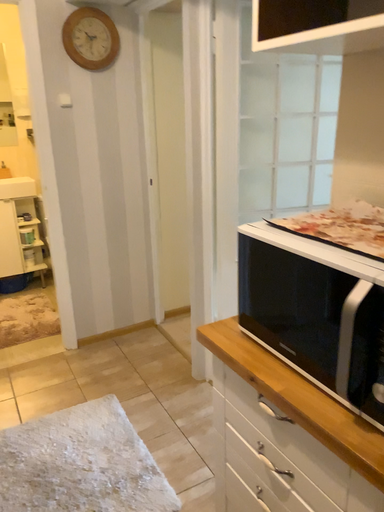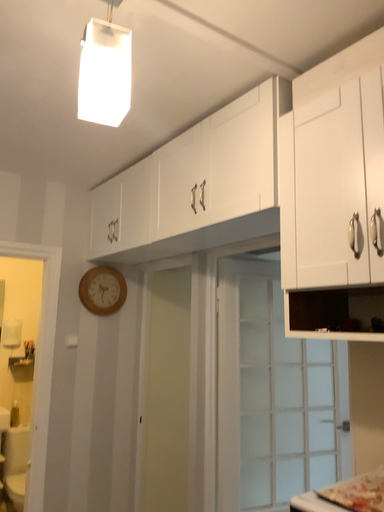
Question: Which way did the camera rotate in the video?

Choices:
 (A) rotated left
 (B) rotated right

Answer: (B)